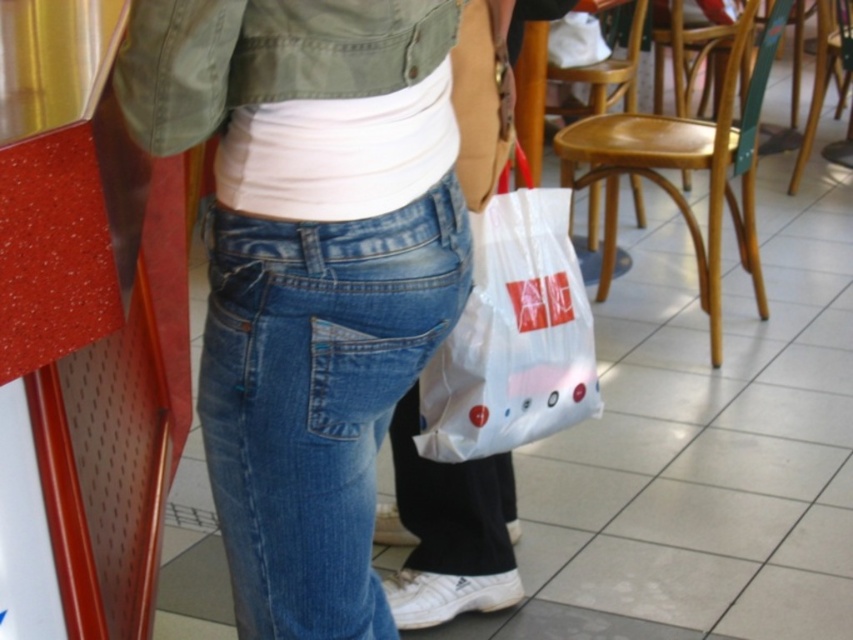
Question: Is the position of blue denim jeans at center less distant than that of white plastic bag at center?

Choices:
 (A) no
 (B) yes

Answer: (B)

Question: Does blue denim jeans at center appear over white plastic bag at center?

Choices:
 (A) no
 (B) yes

Answer: (A)

Question: Which of the following is the closest to the observer?

Choices:
 (A) white plastic bag at center
 (B) blue denim jeans at center

Answer: (B)

Question: Is blue denim jeans at center smaller than white plastic bag at center?

Choices:
 (A) yes
 (B) no

Answer: (A)

Question: Among these points, which one is farthest from the camera?

Choices:
 (A) (259, 545)
 (B) (592, 321)

Answer: (B)

Question: Among these objects, which one is farthest from the camera?

Choices:
 (A) blue denim jeans at center
 (B) white plastic bag at center

Answer: (B)